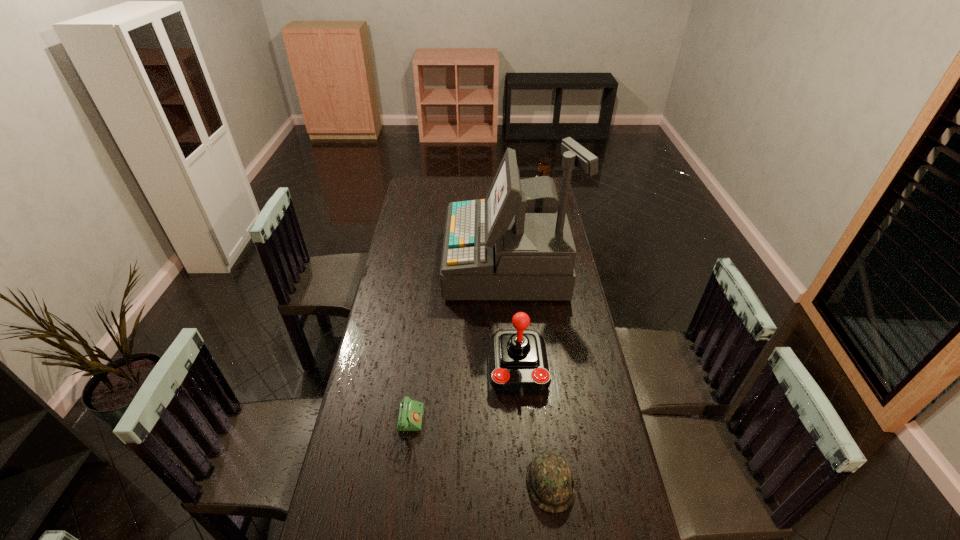
Locate an element on the screen. Image resolution: width=960 pixels, height=540 pixels. headwear at the right edge is located at coordinates (550, 482).

Image resolution: width=960 pixels, height=540 pixels. In order to click on object that is positioned at the far right corner in this screenshot , I will do `click(543, 167)`.

In order to click on vacant area at the far edge of the desktop in this screenshot , I will do `click(484, 181)`.

I want to click on free space at the left edge of the desktop, so click(367, 406).

The width and height of the screenshot is (960, 540). I want to click on free space at the right edge of the desktop, so click(x=567, y=370).

The width and height of the screenshot is (960, 540). I want to click on free space between the joystick and the shortest object, so click(x=463, y=401).

In order to click on vacant space in between the joystick and the leftmost object in this screenshot , I will do `click(463, 401)`.

Image resolution: width=960 pixels, height=540 pixels. I want to click on free space between the headwear and the telephone, so click(x=479, y=458).

This screenshot has width=960, height=540. Find the location of `free space between the cash register and the telephone`. free space between the cash register and the telephone is located at coordinates (458, 348).

Find the location of a particular element. vacant region between the fourth tallest object and the lantern is located at coordinates (545, 340).